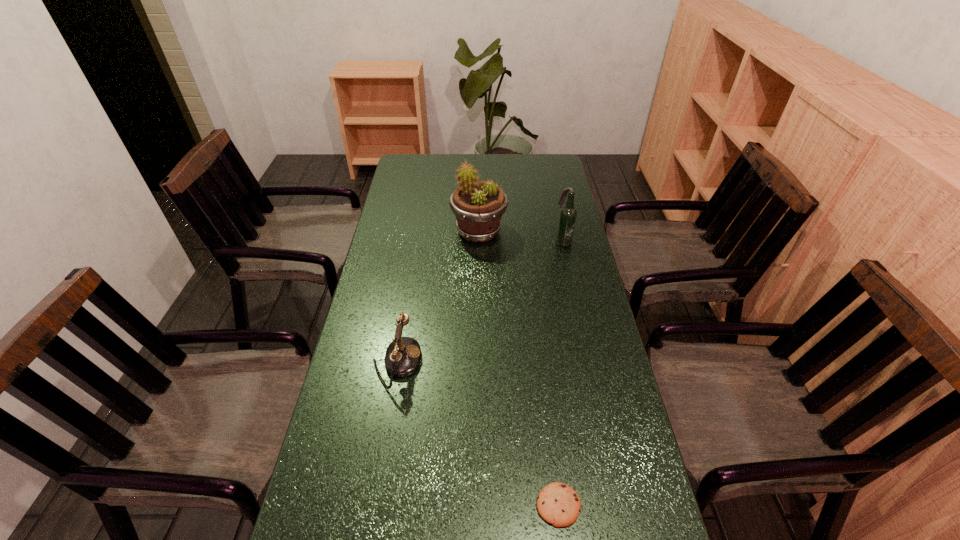
You are a GUI agent. You are given a task and a screenshot of the screen. Output one action in this format:
    pyautogui.click(x=<x>, y=<y>)
    Task: Click on the third object from right to left
    Image resolution: width=960 pixels, height=540 pixels.
    Given the screenshot: What is the action you would take?
    pyautogui.click(x=478, y=206)

Find the location of a particular element. The width and height of the screenshot is (960, 540). the tallest object is located at coordinates (478, 206).

The image size is (960, 540). I want to click on the third shortest object, so click(x=567, y=219).

The height and width of the screenshot is (540, 960). What are the coordinates of `the rightmost object` in the screenshot? It's located at (567, 219).

Image resolution: width=960 pixels, height=540 pixels. Identify the location of the third farthest object. (402, 357).

You are a GUI agent. You are given a task and a screenshot of the screen. Output one action in this format:
    pyautogui.click(x=<x>, y=<y>)
    Task: Click on the leftmost object
    Image resolution: width=960 pixels, height=540 pixels.
    Given the screenshot: What is the action you would take?
    pyautogui.click(x=402, y=357)

The height and width of the screenshot is (540, 960). I want to click on the nearest object, so click(558, 504).

Where is `the shortest object`? the shortest object is located at coordinates (558, 504).

I want to click on vacant space located on the front of the tallest object, so click(479, 300).

Locate an element on the screen. The image size is (960, 540). blank space located on the left of the rightmost object is located at coordinates (495, 241).